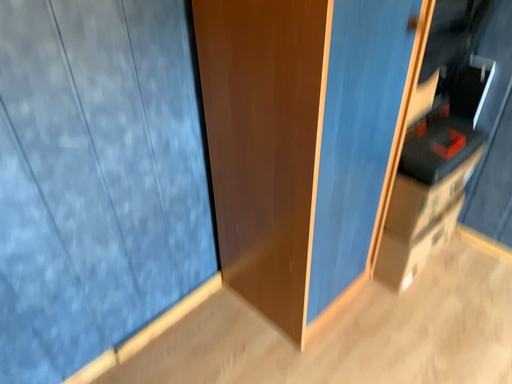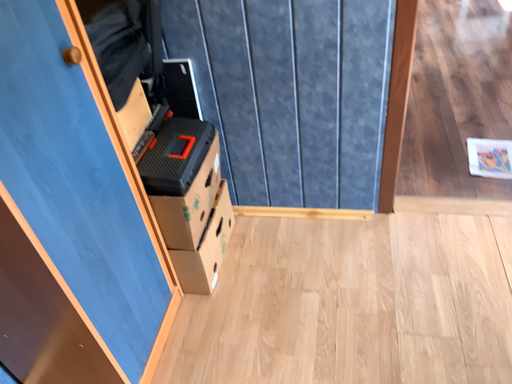
Question: Which way did the camera rotate in the video?

Choices:
 (A) rotated upward
 (B) rotated downward

Answer: (A)